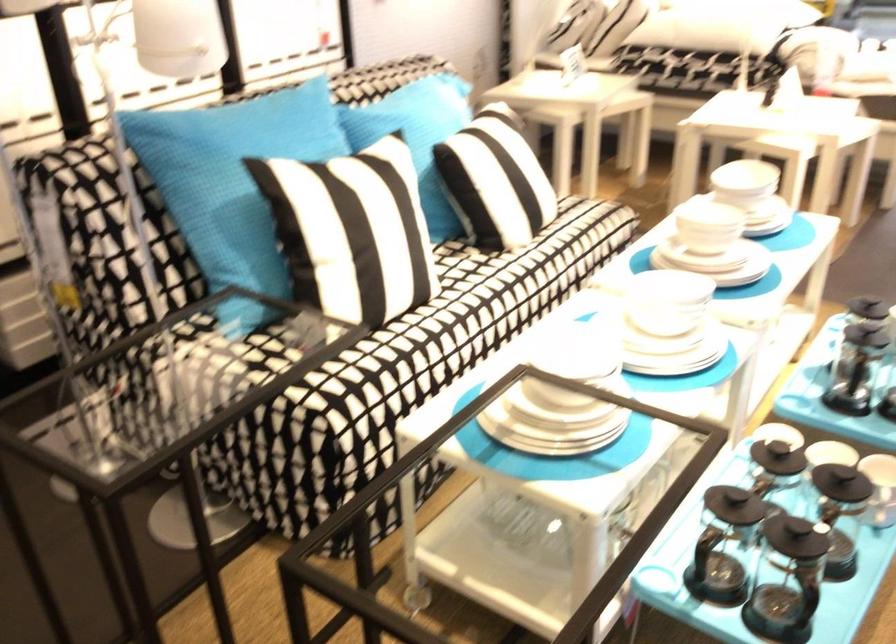
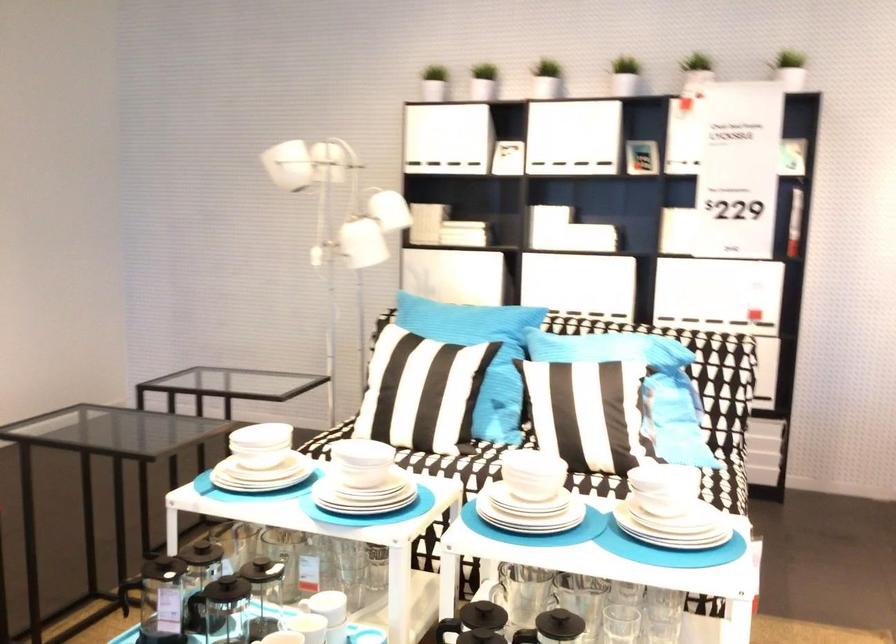
The point at (764, 451) is marked in the first image. Where is the corresponding point in the second image?

(264, 558)